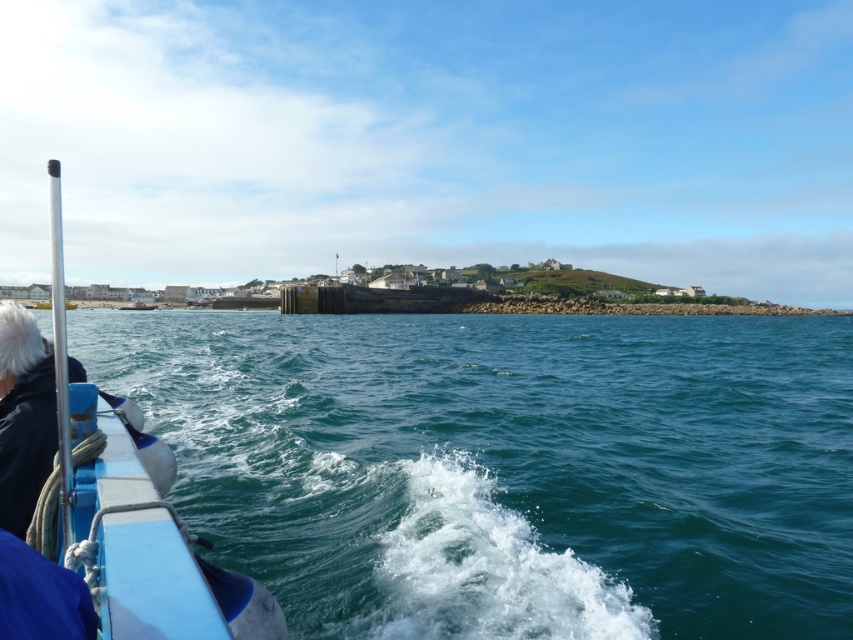
Question: Where is teal water at lower left located in relation to blue rubber boat at left in the image?

Choices:
 (A) above
 (B) below

Answer: (B)

Question: Can you confirm if teal water at lower left is positioned to the left of blue rubber boat at left?

Choices:
 (A) no
 (B) yes

Answer: (A)

Question: Does teal water at lower left appear on the right side of blue rubber boat at left?

Choices:
 (A) no
 (B) yes

Answer: (B)

Question: Which point is closer to the camera taking this photo?

Choices:
 (A) pyautogui.click(x=53, y=428)
 (B) pyautogui.click(x=842, y=630)

Answer: (A)